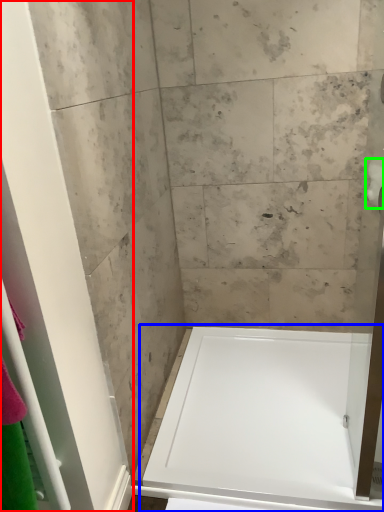
Question: Based on their relative distances, which object is farther from screen door (highlighted by a red box)? Choose from bathtub (highlighted by a blue box) and toilet paper (highlighted by a green box).

Choices:
 (A) bathtub
 (B) toilet paper

Answer: (B)